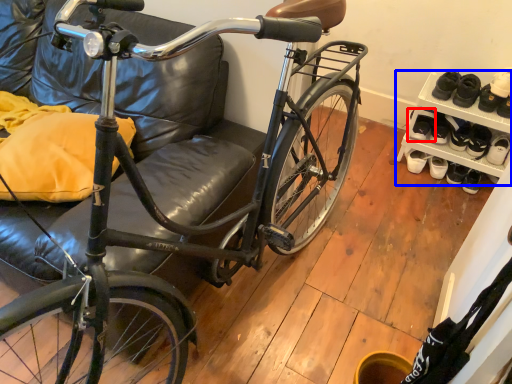
Question: Which of the following is the closest to the observer, footwear (highlighted by a red box) or shelf (highlighted by a blue box)?

Choices:
 (A) footwear
 (B) shelf

Answer: (B)